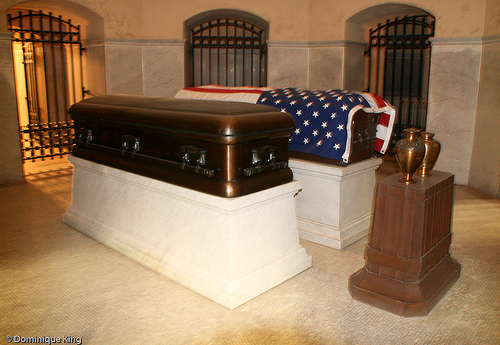
Locate an element on the screen. wooden stand is located at coordinates (383, 237).